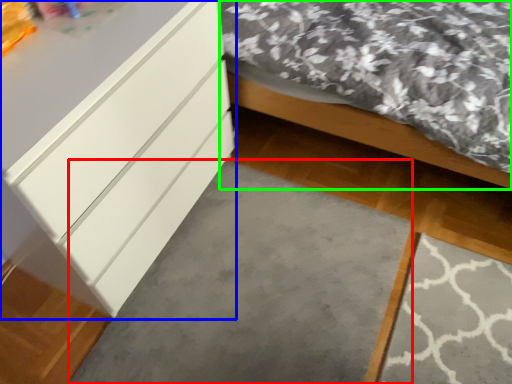
Question: Which object is positioned closest to concrete (highlighted by a red box)? Select from chest of drawers (highlighted by a blue box) and bed (highlighted by a green box).

Choices:
 (A) chest of drawers
 (B) bed

Answer: (A)